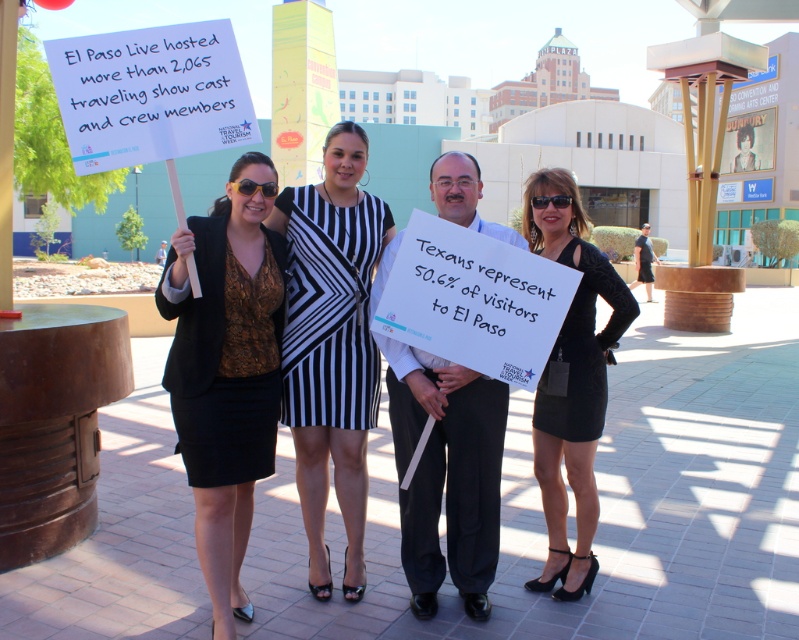
Question: Which point is closer to the camera taking this photo?

Choices:
 (A) (237, 355)
 (B) (571, 248)
 (C) (372, 195)

Answer: (A)

Question: Is matte gold blouse at left to the right of black velvet dress at center from the viewer's perspective?

Choices:
 (A) yes
 (B) no

Answer: (B)

Question: Where is matte gold blouse at left located in relation to black and white striped dress at center in the image?

Choices:
 (A) left
 (B) right

Answer: (A)

Question: Does black and white striped dress at center have a greater width compared to black velvet dress at center?

Choices:
 (A) yes
 (B) no

Answer: (A)

Question: Estimate the real-world distances between objects in this image. Which object is farther from the black velvet dress at center?

Choices:
 (A) black and white striped dress at center
 (B) matte gold blouse at left

Answer: (B)

Question: Which object is closer to the camera taking this photo?

Choices:
 (A) matte gold blouse at left
 (B) black velvet dress at center
 (C) black and white striped dress at center

Answer: (A)